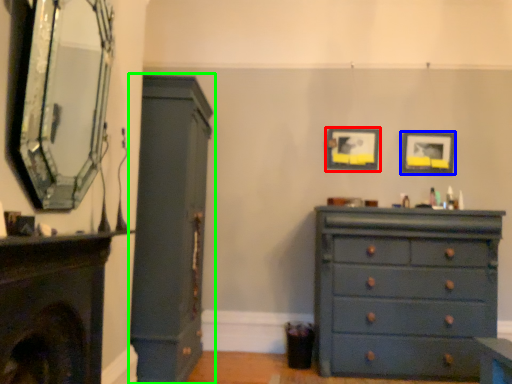
Question: Which object is positioned farthest from picture frame (highlighted by a red box)? Select from picture frame (highlighted by a blue box) and cupboard (highlighted by a green box).

Choices:
 (A) picture frame
 (B) cupboard

Answer: (B)